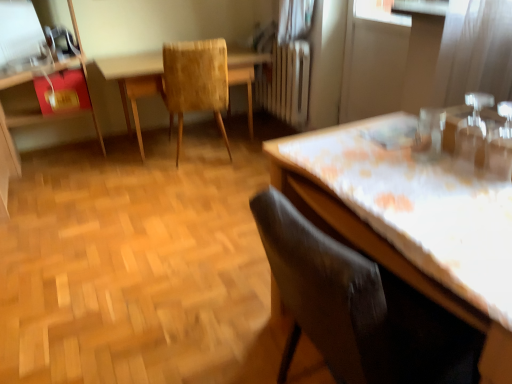
Question: Is matte red dresser at left to the right of wooden textured table at center from the viewer's perspective?

Choices:
 (A) no
 (B) yes

Answer: (A)

Question: Is matte red dresser at left aimed at wooden textured table at center?

Choices:
 (A) yes
 (B) no

Answer: (B)

Question: Is matte red dresser at left next to wooden textured table at center and touching it?

Choices:
 (A) no
 (B) yes

Answer: (A)

Question: From the image's perspective, is matte red dresser at left located above wooden textured table at center?

Choices:
 (A) yes
 (B) no

Answer: (B)

Question: Is matte red dresser at left turned away from wooden textured table at center?

Choices:
 (A) yes
 (B) no

Answer: (B)

Question: Visually, is velvet dark brown chair at lower right, the 1th chair when ordered from right to left, positioned to the left or to the right of transparent plastic screen door at upper right?

Choices:
 (A) right
 (B) left

Answer: (B)

Question: From the image's perspective, is velvet dark brown chair at lower right, the 2th chair when ordered from left to right, located above or below transparent plastic screen door at upper right?

Choices:
 (A) above
 (B) below

Answer: (B)

Question: Is velvet dark brown chair at lower right, the first chair from the bottom, bigger or smaller than transparent plastic screen door at upper right?

Choices:
 (A) small
 (B) big

Answer: (B)

Question: From a real-world perspective, relative to transparent plastic screen door at upper right, is velvet dark brown chair at lower right, acting as the 1th chair starting from the front, vertically above or below?

Choices:
 (A) above
 (B) below

Answer: (B)

Question: Looking at their shapes, would you say wooden textured table at center is wider or thinner than transparent plastic window screen at upper left?

Choices:
 (A) thin
 (B) wide

Answer: (B)

Question: Considering the relative positions of wooden textured table at center and transparent plastic window screen at upper left in the image provided, is wooden textured table at center to the left or to the right of transparent plastic window screen at upper left?

Choices:
 (A) left
 (B) right

Answer: (B)

Question: Considering the positions of wooden textured table at center and transparent plastic window screen at upper left in the image, is wooden textured table at center bigger or smaller than transparent plastic window screen at upper left?

Choices:
 (A) big
 (B) small

Answer: (A)

Question: Do you think wooden textured table at center is within transparent plastic window screen at upper left, or outside of it?

Choices:
 (A) inside
 (B) outside

Answer: (B)

Question: From a real-world perspective, relative to white floral tablecloth at right, is wooden textured table at center vertically above or below?

Choices:
 (A) above
 (B) below

Answer: (B)

Question: Considering the relative positions of wooden textured table at center and white floral tablecloth at right in the image provided, is wooden textured table at center to the left or to the right of white floral tablecloth at right?

Choices:
 (A) left
 (B) right

Answer: (A)